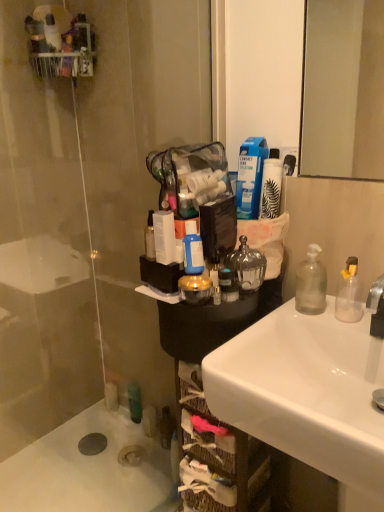
What is the approximate width of blue plastic bottle at upper center?

blue plastic bottle at upper center is 12.43 centimeters wide.

Describe the element at coordinates (193, 250) in the screenshot. I see `blue matte bottle at center, which is counted as the second bottle, starting from the right` at that location.

Where is `transparent glass door at left`? transparent glass door at left is located at coordinates (41, 251).

Describe the element at coordinates (247, 266) in the screenshot. I see `clear glass jar at center, which is counted as the second toiletry, starting from the top` at that location.

What do you see at coordinates (307, 394) in the screenshot? I see `white glossy sink at lower right` at bounding box center [307, 394].

The width and height of the screenshot is (384, 512). Describe the element at coordinates (271, 186) in the screenshot. I see `white matte bottle at upper right, which is counted as the 1th toiletry, starting from the top` at that location.

You are a GUI agent. You are given a task and a screenshot of the screen. Output one action in this format:
    pyautogui.click(x=<x>, y=<y>)
    Task: Click on the white matte bottle at upper right, the 2th toiletry ordered from the bottom
    This screenshot has height=512, width=384.
    Given the screenshot: What is the action you would take?
    pyautogui.click(x=271, y=186)

This screenshot has width=384, height=512. Identify the location of blue plastic bottle at upper center. (250, 176).

Can you confirm if clear glass jar at center, placed as the first toiletry when sorted from bottom to top, is wider than blue matte bottle at center, the 1th bottle viewed from the left?

Yes, clear glass jar at center, placed as the first toiletry when sorted from bottom to top, is wider than blue matte bottle at center, the 1th bottle viewed from the left.

Is clear glass jar at center, placed as the first toiletry when sorted from bottom to top, aimed at blue matte bottle at center, the 1th bottle viewed from the left?

Yes, clear glass jar at center, placed as the first toiletry when sorted from bottom to top, is oriented towards blue matte bottle at center, the 1th bottle viewed from the left.

Does clear glass jar at center, placed as the first toiletry when sorted from bottom to top, come behind blue matte bottle at center, which is counted as the second bottle, starting from the right?

Yes, it is behind blue matte bottle at center, which is counted as the second bottle, starting from the right.

From the image's perspective, is clear glass jar at center, which is counted as the second toiletry, starting from the top, above or below blue matte bottle at center, which is counted as the second bottle, starting from the right?

From the image's perspective, clear glass jar at center, which is counted as the second toiletry, starting from the top, appears below blue matte bottle at center, which is counted as the second bottle, starting from the right.

Identify the location of bottle that is the 1st object located in front of the transparent glass door at left. (311, 283).

Considering the relative sizes of transparent glass soap dispenser at right, arranged as the first bottle when viewed from the right, and transparent glass door at left in the image provided, is transparent glass soap dispenser at right, arranged as the first bottle when viewed from the right, taller than transparent glass door at left?

No.

Is transparent glass soap dispenser at right, arranged as the first bottle when viewed from the right, not close to transparent glass door at left?

That's right, there is a large distance between transparent glass soap dispenser at right, arranged as the first bottle when viewed from the right, and transparent glass door at left.

Does transparent glass soap dispenser at right, arranged as the first bottle when viewed from the right, have a lesser width compared to transparent glass door at left?

No.

Considering the sizes of woven brown basket at lower center and clear glass jar at center, which is counted as the second toiletry, starting from the top, in the image, is woven brown basket at lower center bigger or smaller than clear glass jar at center, which is counted as the second toiletry, starting from the top,?

In the image, woven brown basket at lower center appears to be larger than clear glass jar at center, which is counted as the second toiletry, starting from the top.

Is woven brown basket at lower center positioned far away from clear glass jar at center, which is counted as the second toiletry, starting from the top?

That's not correct — woven brown basket at lower center is a little close to clear glass jar at center, which is counted as the second toiletry, starting from the top.

From their relative heights in the image, would you say woven brown basket at lower center is taller or shorter than clear glass jar at center, placed as the first toiletry when sorted from bottom to top?

In the image, woven brown basket at lower center appears to be taller than clear glass jar at center, placed as the first toiletry when sorted from bottom to top.

In the scene shown: Is woven brown basket at lower center facing towards clear glass jar at center, placed as the first toiletry when sorted from bottom to top?

No, woven brown basket at lower center is not turned towards clear glass jar at center, placed as the first toiletry when sorted from bottom to top.

Is white matte bath at lower left oriented towards woven brown basket at lower center?

Yes, white matte bath at lower left is aimed at woven brown basket at lower center.

Can you confirm if white matte bath at lower left is positioned to the left of woven brown basket at lower center?

Indeed, white matte bath at lower left is positioned on the left side of woven brown basket at lower center.

Choose the correct answer: Is white matte bath at lower left inside woven brown basket at lower center or outside it?

white matte bath at lower left is outside woven brown basket at lower center.

From a real-world perspective, is white matte bottle at upper right, the 2th toiletry ordered from the bottom, physically above transparent glass door at left?

Yes, from a real-world perspective, white matte bottle at upper right, the 2th toiletry ordered from the bottom, is over transparent glass door at left

Looking at this image, considering the relative sizes of white matte bottle at upper right, which is counted as the 1th toiletry, starting from the top, and transparent glass door at left in the image provided, is white matte bottle at upper right, which is counted as the 1th toiletry, starting from the top, smaller than transparent glass door at left?

Correct, white matte bottle at upper right, which is counted as the 1th toiletry, starting from the top, occupies less space than transparent glass door at left.

Can you confirm if white matte bottle at upper right, which is counted as the 1th toiletry, starting from the top, is shorter than transparent glass door at left?

Indeed, white matte bottle at upper right, which is counted as the 1th toiletry, starting from the top, has a lesser height compared to transparent glass door at left.

Does white matte bottle at upper right, the 2th toiletry ordered from the bottom, come behind transparent glass door at left?

No, it is in front of transparent glass door at left.

Can you confirm if transparent glass soap dispenser at right, the second bottle from the left, is bigger than woven brown basket at lower center?

Incorrect, transparent glass soap dispenser at right, the second bottle from the left, is not larger than woven brown basket at lower center.

Does transparent glass soap dispenser at right, the second bottle from the left, lie in front of woven brown basket at lower center?

No, transparent glass soap dispenser at right, the second bottle from the left, is further to the viewer.

Is transparent glass soap dispenser at right, the second bottle from the left, outside of woven brown basket at lower center?

transparent glass soap dispenser at right, the second bottle from the left, lies outside woven brown basket at lower center's area.

From a real-world perspective, which object stands above the other?

blue matte bottle at center, the 1th bottle viewed from the left, is physically above.

Is woven brown basket at lower center a part of blue matte bottle at center, which is counted as the second bottle, starting from the right?

No, woven brown basket at lower center is not surrounded by blue matte bottle at center, which is counted as the second bottle, starting from the right.

From the image's perspective, which one is positioned lower, blue matte bottle at center, which is counted as the second bottle, starting from the right, or woven brown basket at lower center?

From the image's view, woven brown basket at lower center is below.

Is blue matte bottle at center, which is counted as the second bottle, starting from the right, facing towards woven brown basket at lower center?

No.

Locate an element on the screen. The image size is (384, 512). toiletry below the blue matte bottle at center, which is counted as the second bottle, starting from the right (from a real-world perspective) is located at coordinates (247, 266).

The width and height of the screenshot is (384, 512). I want to click on the 2nd bottle counting from the right of the transparent glass door at left, so click(x=311, y=283).

Estimate the real-world distances between objects in this image. Which object is closer to blue plastic bottle at upper center, white glossy sink at lower right or transparent glass door at left?

Among the two, white glossy sink at lower right is located nearer to blue plastic bottle at upper center.

From the image, which object appears to be farther from transparent glass soap dispenser at right, arranged as the first bottle when viewed from the right, blue matte bottle at center, the 1th bottle viewed from the left, or woven brown basket at lower center?

Based on the image, woven brown basket at lower center appears to be further to transparent glass soap dispenser at right, arranged as the first bottle when viewed from the right.

Looking at this image, looking at the image, which one is located further to transparent glass soap dispenser at right, arranged as the first bottle when viewed from the right, white glossy sink at lower right or white matte bottle at upper right, which is counted as the 1th toiletry, starting from the top?

Among the two, white glossy sink at lower right is located further to transparent glass soap dispenser at right, arranged as the first bottle when viewed from the right.

In the scene shown: Which object lies nearer to the anchor point transparent glass soap dispenser at right, the second bottle from the left, transparent glass door at left or blue plastic bottle at upper center?

Among the two, blue plastic bottle at upper center is located nearer to transparent glass soap dispenser at right, the second bottle from the left.

Estimate the real-world distances between objects in this image. Which object is further from white glossy sink at lower right, transparent glass soap dispenser at right, the second bottle from the left, or transparent glass door at left?

transparent glass door at left is positioned further to the anchor white glossy sink at lower right.

Considering their positions, is transparent glass soap dispenser at right, the second bottle from the left, positioned closer to blue plastic bottle at upper center than clear glass jar at center, placed as the first toiletry when sorted from bottom to top?

Based on the image, clear glass jar at center, placed as the first toiletry when sorted from bottom to top, appears to be nearer to blue plastic bottle at upper center.

Looking at the image, which one is located further to white glossy sink at lower right, blue plastic bottle at upper center or white matte bottle at upper right, the 2th toiletry ordered from the bottom?

white matte bottle at upper right, the 2th toiletry ordered from the bottom, lies further to white glossy sink at lower right than the other object.

From the image, which object appears to be farther from transparent glass door at left, clear glass jar at center, placed as the first toiletry when sorted from bottom to top, or white glossy sink at lower right?

Based on the image, white glossy sink at lower right appears to be further to transparent glass door at left.

Locate an element on the screen. Image resolution: width=384 pixels, height=512 pixels. bottle between blue matte bottle at center, the 1th bottle viewed from the left, and white glossy sink at lower right vertically is located at coordinates (311, 283).

At what (x,y) coordinates should I click in order to perform the action: click on toiletry that lies between white matte bottle at upper right, the 2th toiletry ordered from the bottom, and woven brown basket at lower center from top to bottom. Please return your answer as a coordinate pair (x, y). The width and height of the screenshot is (384, 512). Looking at the image, I should click on (247, 266).

Find the location of a particular element. The image size is (384, 512). toiletry that lies between white matte bottle at upper right, the 2th toiletry ordered from the bottom, and white matte bath at lower left from top to bottom is located at coordinates (247, 266).

The height and width of the screenshot is (512, 384). I want to click on sink that lies between transparent glass soap dispenser at right, the second bottle from the left, and woven brown basket at lower center from top to bottom, so click(307, 394).